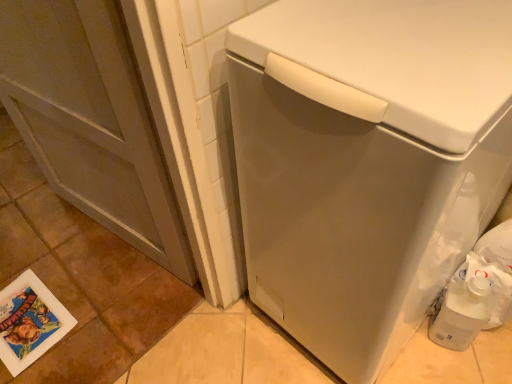
Question: Does point coord(34,51) appear closer or farther from the camera than point coord(20,332)?

Choices:
 (A) closer
 (B) farther

Answer: (A)

Question: In terms of size, does matte gray screen door at left appear bigger or smaller than printed paper postcard at lower left?

Choices:
 (A) big
 (B) small

Answer: (A)

Question: Considering the real-world distances, which object is closest to the white plastic jug at lower right?

Choices:
 (A) matte gray screen door at left
 (B) white matte washing machine at center
 (C) printed paper postcard at lower left

Answer: (B)

Question: Estimate the real-world distances between objects in this image. Which object is farther from the white matte washing machine at center?

Choices:
 (A) white plastic jug at lower right
 (B) matte gray screen door at left
 (C) printed paper postcard at lower left

Answer: (C)